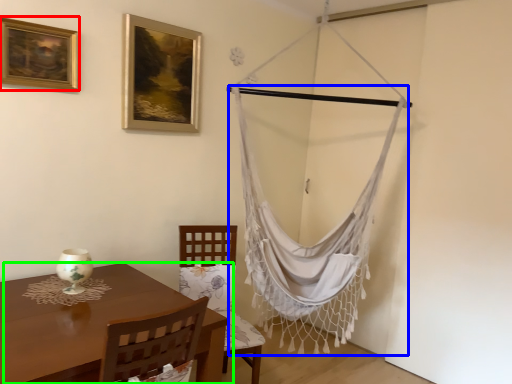
Question: Considering the real-world distances, which object is closest to picture frame (highlighted by a red box)? curtain (highlighted by a blue box) or table (highlighted by a green box).

Choices:
 (A) curtain
 (B) table

Answer: (B)